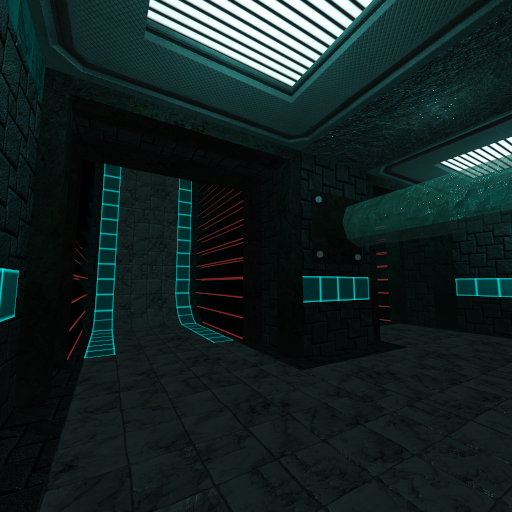
The height and width of the screenshot is (512, 512). What are the coordinates of `ceiling` in the screenshot? It's located at (312, 76).